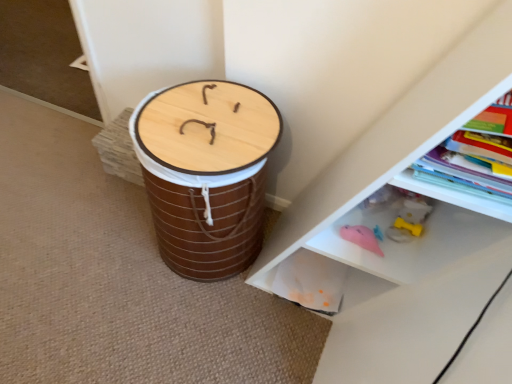
Question: Could you tell me if wooden drum at center is facing white plastic shelf at lower right?

Choices:
 (A) no
 (B) yes

Answer: (A)

Question: Can you confirm if wooden drum at center is bigger than white plastic shelf at lower right?

Choices:
 (A) yes
 (B) no

Answer: (B)

Question: From a real-world perspective, is wooden drum at center on white plastic shelf at lower right?

Choices:
 (A) yes
 (B) no

Answer: (B)

Question: Is there a large distance between wooden drum at center and white plastic shelf at lower right?

Choices:
 (A) yes
 (B) no

Answer: (B)

Question: Is wooden drum at center in front of white plastic shelf at lower right?

Choices:
 (A) yes
 (B) no

Answer: (B)

Question: From a real-world perspective, relative to white plastic shelf at lower right, is wooden drum at center vertically above or below?

Choices:
 (A) below
 (B) above

Answer: (A)

Question: From their relative heights in the image, would you say wooden drum at center is taller or shorter than white plastic shelf at lower right?

Choices:
 (A) tall
 (B) short

Answer: (B)

Question: Is wooden drum at center situated inside white plastic shelf at lower right or outside?

Choices:
 (A) outside
 (B) inside

Answer: (A)

Question: Relative to white plastic shelf at lower right, is wooden drum at center in front or behind?

Choices:
 (A) front
 (B) behind

Answer: (B)

Question: Is hardcover book at upper right in front of or behind wooden drum at center in the image?

Choices:
 (A) front
 (B) behind

Answer: (A)

Question: Do you think hardcover book at upper right is within wooden drum at center, or outside of it?

Choices:
 (A) outside
 (B) inside

Answer: (A)

Question: From a real-world perspective, is hardcover book at upper right physically located above or below wooden drum at center?

Choices:
 (A) below
 (B) above

Answer: (B)

Question: In terms of height, does hardcover book at upper right look taller or shorter compared to wooden drum at center?

Choices:
 (A) short
 (B) tall

Answer: (A)

Question: Is wooden drum at center taller or shorter than hardcover book at upper right?

Choices:
 (A) tall
 (B) short

Answer: (A)

Question: Considering the positions of wooden drum at center and hardcover book at upper right in the image, is wooden drum at center bigger or smaller than hardcover book at upper right?

Choices:
 (A) small
 (B) big

Answer: (B)